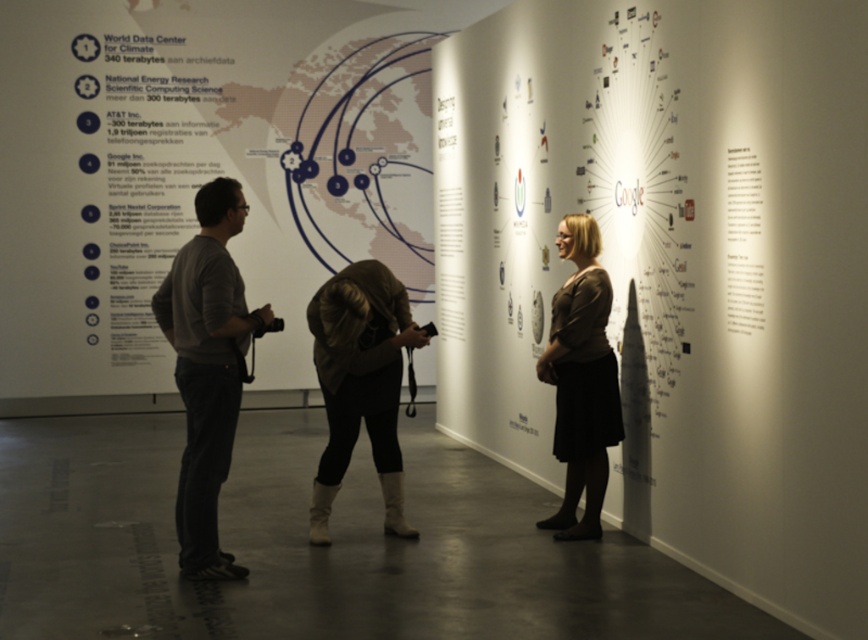
You are a tour guide leading a group through the exhibition. You need to move between the gray cotton shirt at center and the dark brown sweater at center to answer a question. Can you comfortably walk between them without needing to move any other people?

The gray cotton shirt at center and the dark brown sweater at center are 3.02 meters apart from each other, so yes, you can comfortably walk between them without needing to move any other people since the distance is sufficient for movement.

You are standing in the exhibition space and want to approach the dark brown sweater at center. Which direction should you move from the leather boots at center to reach it?

The dark brown sweater at center is to the right of the leather boots at center, so you should move to the right from the leather boots at center to reach it.